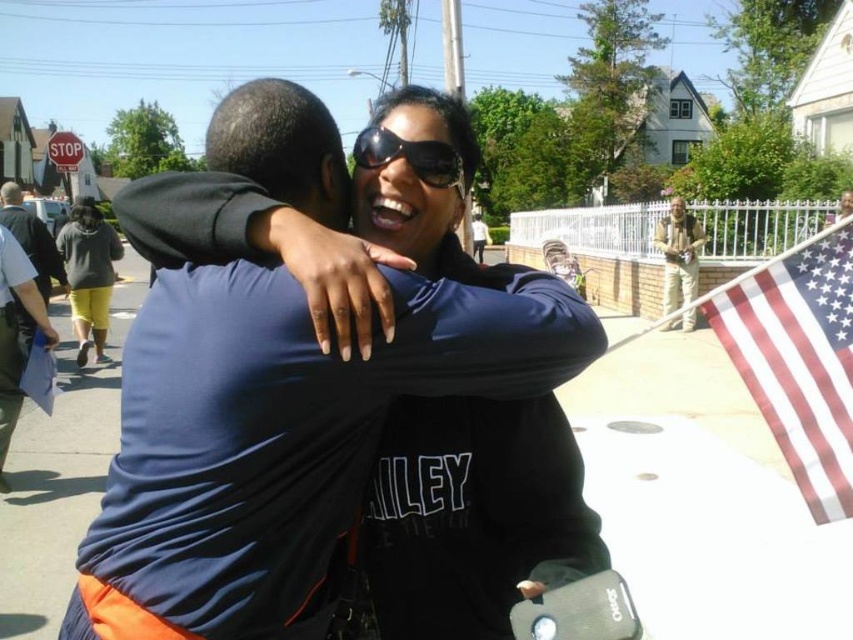
You are a photographer trying to capture the sunglasses at center and the american flag at right in your shot. Based on their positions, which object should you focus on first to ensure both are in frame?

The sunglasses at center is above the american flag at right, so you should focus on the sunglasses at center first to ensure both are in frame.